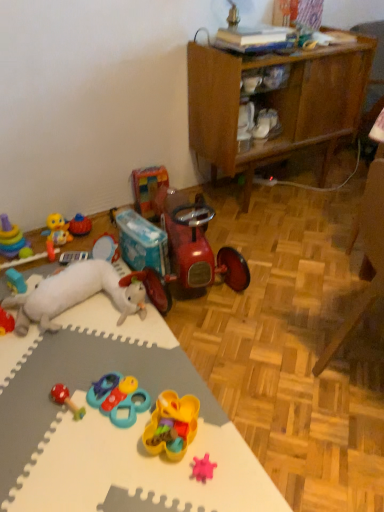
You are a GUI agent. You are given a task and a screenshot of the screen. Output one action in this format:
    pyautogui.click(x=<x>, y=<y>)
    Task: Click on the free point behind rubber teething ring at lower left, the 3th toy in the left-to-right sequence
    The height and width of the screenshot is (512, 384).
    Given the screenshot: What is the action you would take?
    pyautogui.click(x=36, y=272)